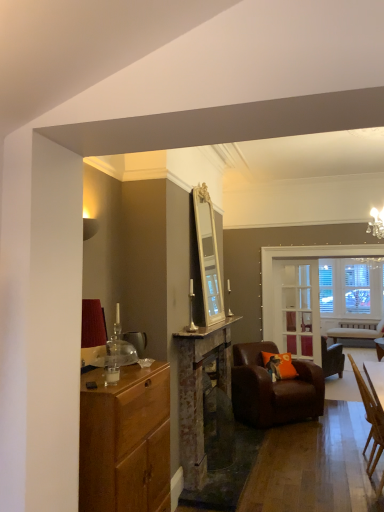
Identify the location of empty space that is ontop of clear glass door at center (from a real-world perspective). (312, 257).